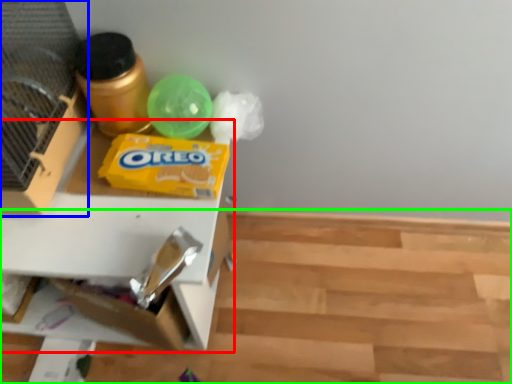
Question: Based on their relative distances, which object is farther from table (highlighted by a red box)? Choose from bird cage (highlighted by a blue box) and wood (highlighted by a green box).

Choices:
 (A) bird cage
 (B) wood

Answer: (B)